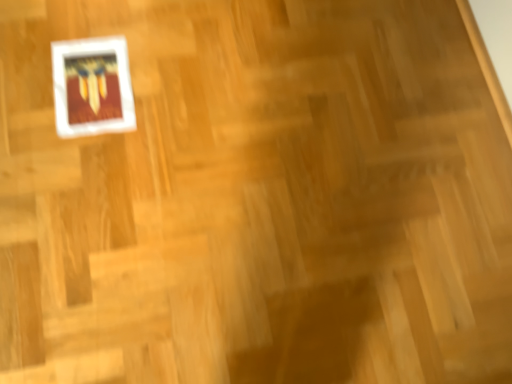
Identify the location of vacant area situated below white glossy picture frame at upper left (from a real-world perspective). (96, 86).